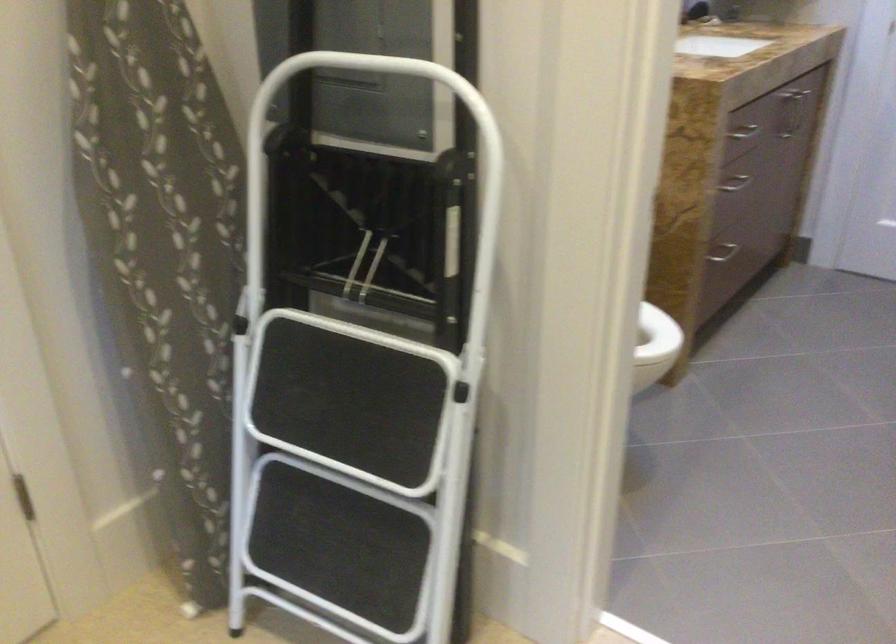
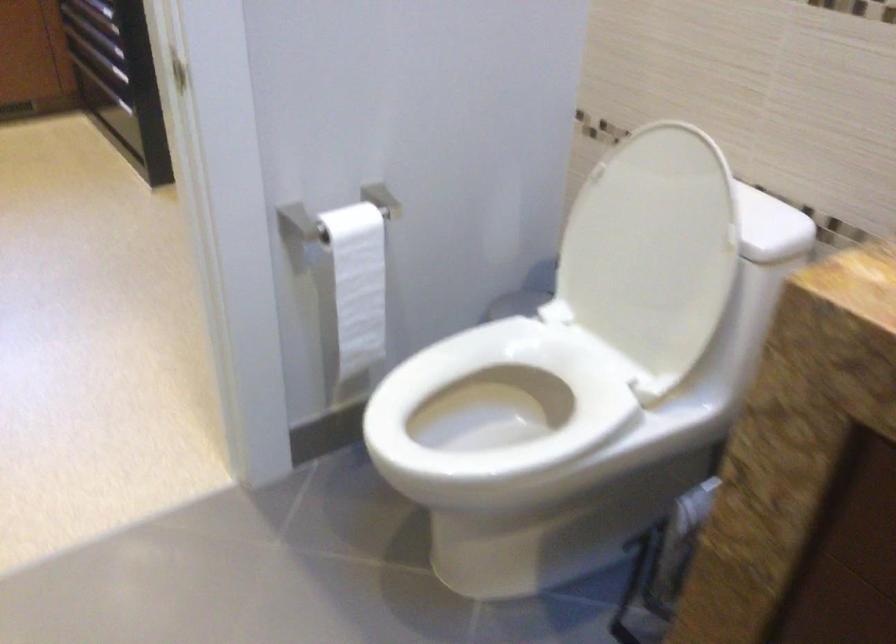
The point at (521, 399) is marked in the first image. Where is the corresponding point in the second image?

(357, 283)